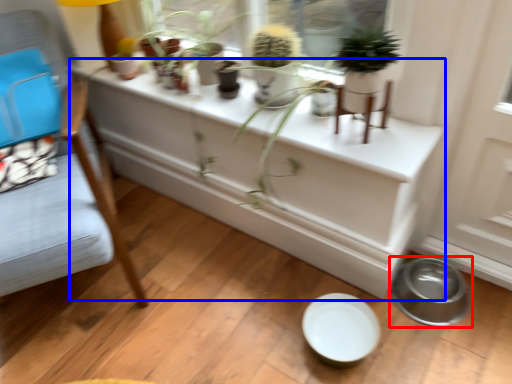
Question: Which object appears closest to the camera in this image, bowl (highlighted by a red box) or table (highlighted by a blue box)?

Choices:
 (A) bowl
 (B) table

Answer: (A)